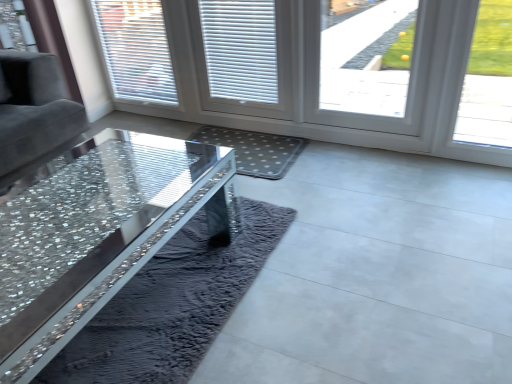
Question: Is gray dotted mat at center outside smooth concrete floor at center?

Choices:
 (A) no
 (B) yes

Answer: (A)

Question: From the image's perspective, does gray dotted mat at center appear higher than smooth concrete floor at center?

Choices:
 (A) yes
 (B) no

Answer: (A)

Question: Is gray dotted mat at center to the right of smooth concrete floor at center from the viewer's perspective?

Choices:
 (A) yes
 (B) no

Answer: (A)

Question: From the image's perspective, does gray dotted mat at center appear lower than smooth concrete floor at center?

Choices:
 (A) no
 (B) yes

Answer: (A)

Question: Considering the relative sizes of gray dotted mat at center and smooth concrete floor at center in the image provided, is gray dotted mat at center wider than smooth concrete floor at center?

Choices:
 (A) no
 (B) yes

Answer: (A)

Question: Is gray dotted mat at center smaller than smooth concrete floor at center?

Choices:
 (A) yes
 (B) no

Answer: (A)

Question: From a real-world perspective, is smooth concrete floor at center located higher than crystal glass table at center?

Choices:
 (A) yes
 (B) no

Answer: (B)

Question: From a real-world perspective, is smooth concrete floor at center positioned under crystal glass table at center based on gravity?

Choices:
 (A) no
 (B) yes

Answer: (B)

Question: Is smooth concrete floor at center oriented towards crystal glass table at center?

Choices:
 (A) no
 (B) yes

Answer: (A)

Question: Is smooth concrete floor at center turned away from crystal glass table at center?

Choices:
 (A) no
 (B) yes

Answer: (A)

Question: Does smooth concrete floor at center have a lesser width compared to crystal glass table at center?

Choices:
 (A) no
 (B) yes

Answer: (A)

Question: Does smooth concrete floor at center come in front of crystal glass table at center?

Choices:
 (A) yes
 (B) no

Answer: (A)

Question: Is there a large distance between white textured blinds at upper left, positioned as the second window in right-to-left order, and smooth concrete floor at center?

Choices:
 (A) yes
 (B) no

Answer: (A)